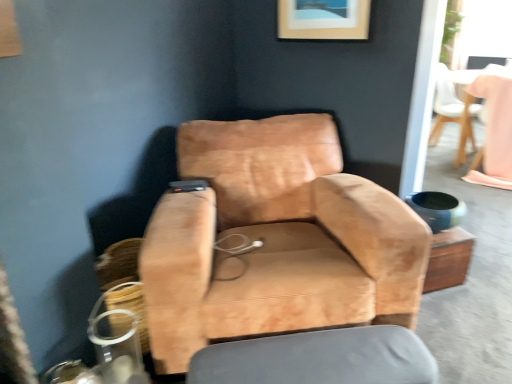
Question: Could you tell me if suede tan chair at center, which appears as the 1th chair when viewed from the left, is facing smooth gray cushion at lower center?

Choices:
 (A) no
 (B) yes

Answer: (B)

Question: From a real-world perspective, is suede tan chair at center, which ranks as the 1th chair in bottom-to-top order, positioned under smooth gray cushion at lower center based on gravity?

Choices:
 (A) yes
 (B) no

Answer: (B)

Question: From the image's perspective, does suede tan chair at center, which appears as the 2th chair when viewed from the right, appear higher than smooth gray cushion at lower center?

Choices:
 (A) no
 (B) yes

Answer: (B)

Question: Does suede tan chair at center, the first chair positioned from the front, appear on the left side of smooth gray cushion at lower center?

Choices:
 (A) no
 (B) yes

Answer: (B)

Question: Can you confirm if suede tan chair at center, which ranks as the 1th chair in bottom-to-top order, is thinner than smooth gray cushion at lower center?

Choices:
 (A) no
 (B) yes

Answer: (A)

Question: Is suede tan chair at center, the 2th chair from the top, facing towards wooden picture frame at upper center?

Choices:
 (A) no
 (B) yes

Answer: (A)

Question: Is suede tan chair at center, which appears as the 1th chair when viewed from the left, far from wooden picture frame at upper center?

Choices:
 (A) yes
 (B) no

Answer: (B)

Question: From the image's perspective, is suede tan chair at center, the first chair positioned from the front, located beneath wooden picture frame at upper center?

Choices:
 (A) yes
 (B) no

Answer: (A)

Question: Is suede tan chair at center, which appears as the 2th chair when viewed from the right, placed right next to wooden picture frame at upper center?

Choices:
 (A) yes
 (B) no

Answer: (B)

Question: Considering the relative sizes of suede tan chair at center, the 2th chair from the top, and wooden picture frame at upper center in the image provided, is suede tan chair at center, the 2th chair from the top, thinner than wooden picture frame at upper center?

Choices:
 (A) yes
 (B) no

Answer: (B)

Question: Can wooden picture frame at upper center be found inside suede tan chair at center, which is the second chair in back-to-front order?

Choices:
 (A) no
 (B) yes

Answer: (A)

Question: Considering the relative positions of wooden picture frame at upper center and pink fabric table at upper right in the image provided, is wooden picture frame at upper center to the left of pink fabric table at upper right from the viewer's perspective?

Choices:
 (A) no
 (B) yes

Answer: (B)